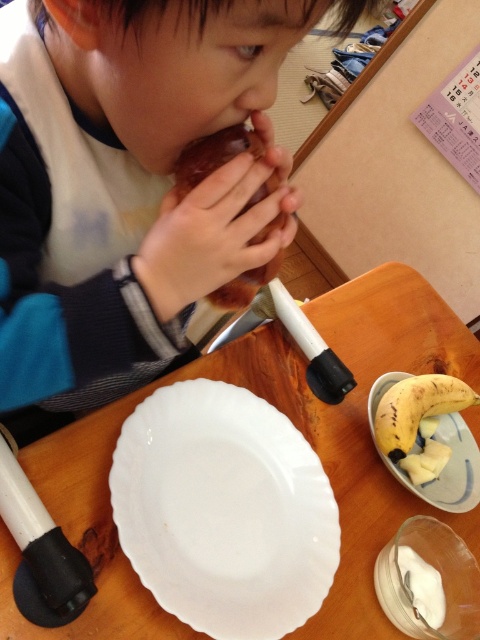
Can you confirm if matte brown donut at upper left is wider than white glossy platter at lower center?

Yes, matte brown donut at upper left is wider than white glossy platter at lower center.

Is matte brown donut at upper left to the right of white glossy platter at lower center from the viewer's perspective?

No, matte brown donut at upper left is not to the right of white glossy platter at lower center.

Which is behind, point (92, 168) or point (263, 403)?

Point (263, 403)

At what (x,y) coordinates should I click in order to perform the action: click on matte brown donut at upper left. Please return your answer as a coordinate pair (x, y). Looking at the image, I should click on (129, 179).

Does matte brown donut at upper left appear under chocolate cake at center?

Yes, matte brown donut at upper left is below chocolate cake at center.

Is matte brown donut at upper left further to camera compared to chocolate cake at center?

That is False.

Where is `matte brown donut at upper left`? The height and width of the screenshot is (640, 480). matte brown donut at upper left is located at coordinates (129, 179).

Based on the photo, who is lower down, matte brown donut at upper left or wooden table at center?

wooden table at center is below.

Image resolution: width=480 pixels, height=640 pixels. What are the coordinates of `matte brown donut at upper left` in the screenshot? It's located at (129, 179).